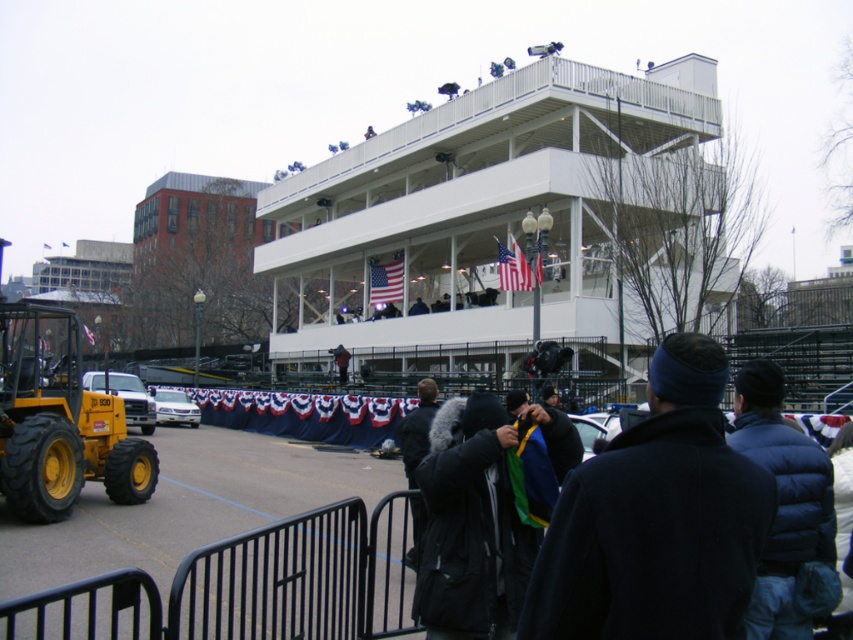
You are a delivery person who needs to move a 10 meter long container from the yellow rubber tractor at lower left to the nearest available storage area. Can you safely transport it without any obstacles?

The yellow rubber tractor at lower left is 10.70 meters away from the nearest available storage area. Since the container is 10 meters long, it can be safely transported as the distance between them allows enough space for maneuvering.